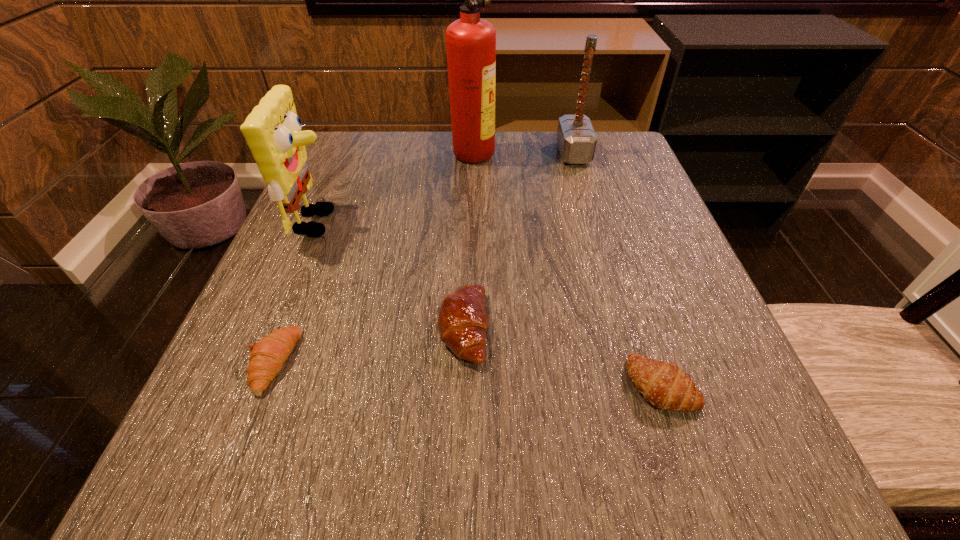
Identify which object is the second closest to the fourth nearest object. Please provide its 2D coordinates. Your answer should be formatted as a tuple, i.e. [(x, y)], where the tuple contains the x and y coordinates of a point satisfying the conditions above.

[(462, 321)]

Identify which crescent roll is the nearest to the fire extinguisher. Please provide its 2D coordinates. Your answer should be formatted as a tuple, i.e. [(x, y)], where the tuple contains the x and y coordinates of a point satisfying the conditions above.

[(462, 321)]

I want to click on the third closest crescent roll relative to the sponge, so click(664, 385).

Locate an element on the screen. blank space that satisfies the following two spatial constraints: 1. on the striking surface of the hammer; 2. on the front side of the leftmost crescent roll is located at coordinates (635, 362).

This screenshot has height=540, width=960. I want to click on blank space that satisfies the following two spatial constraints: 1. on the face of the fourth nearest object; 2. on the back side of the second crescent roll from right to left, so click(x=275, y=328).

I want to click on vacant space that satisfies the following two spatial constraints: 1. on the striking surface of the hammer; 2. on the front side of the leftmost crescent roll, so click(x=635, y=362).

The width and height of the screenshot is (960, 540). I want to click on free location that satisfies the following two spatial constraints: 1. on the striking surface of the hammer; 2. on the right side of the rightmost crescent roll, so (641, 385).

Where is `vacant region that satisfies the following two spatial constraints: 1. on the striking surface of the hammer; 2. on the back side of the rightmost crescent roll`? This screenshot has height=540, width=960. vacant region that satisfies the following two spatial constraints: 1. on the striking surface of the hammer; 2. on the back side of the rightmost crescent roll is located at coordinates (641, 385).